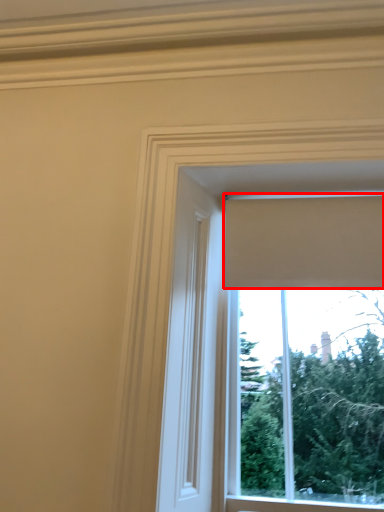
Question: Observing the image, what is the correct spatial positioning of curtain (annotated by the red box) in reference to window?

Choices:
 (A) right
 (B) left

Answer: (A)